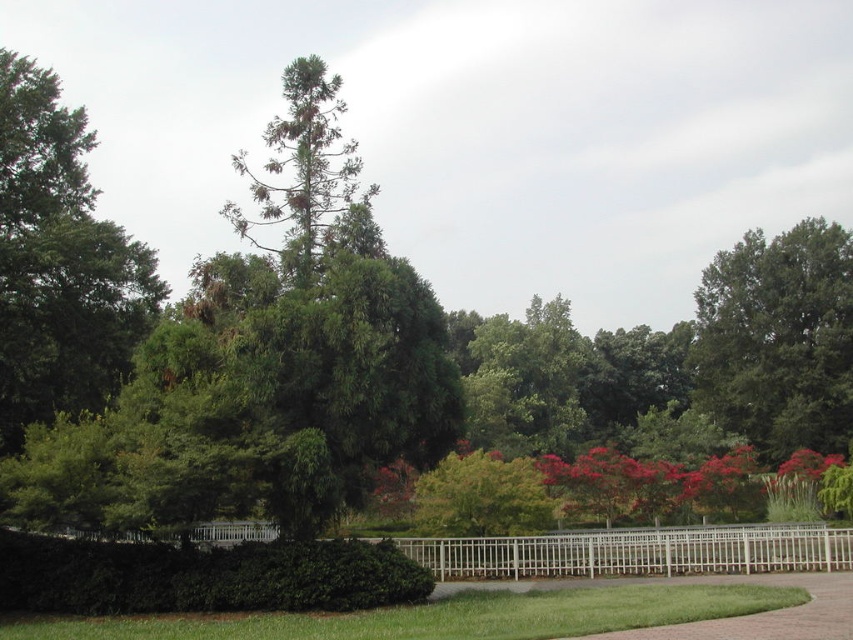
Question: Estimate the real-world distances between objects in this image. Which object is farther from the green leafy tree at left?

Choices:
 (A) green leafy tree at upper right
 (B) white wooden fence at center

Answer: (A)

Question: Can you confirm if green leafy tree at left is thinner than white wooden fence at center?

Choices:
 (A) yes
 (B) no

Answer: (A)

Question: Is green leafy tree at upper right above white wooden fence at center?

Choices:
 (A) no
 (B) yes

Answer: (B)

Question: Which point is farther to the camera?

Choices:
 (A) white wooden fence at center
 (B) green leafy tree at left

Answer: (B)

Question: Among these points, which one is farthest from the camera?

Choices:
 (A) (613, 538)
 (B) (24, 92)

Answer: (B)

Question: Is green leafy tree at left above green leafy tree at upper right?

Choices:
 (A) yes
 (B) no

Answer: (A)